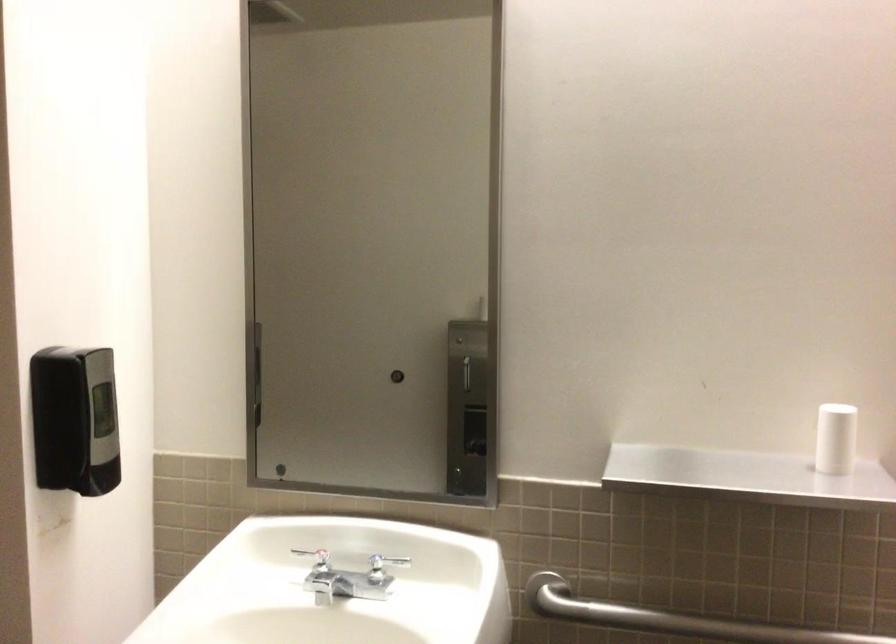
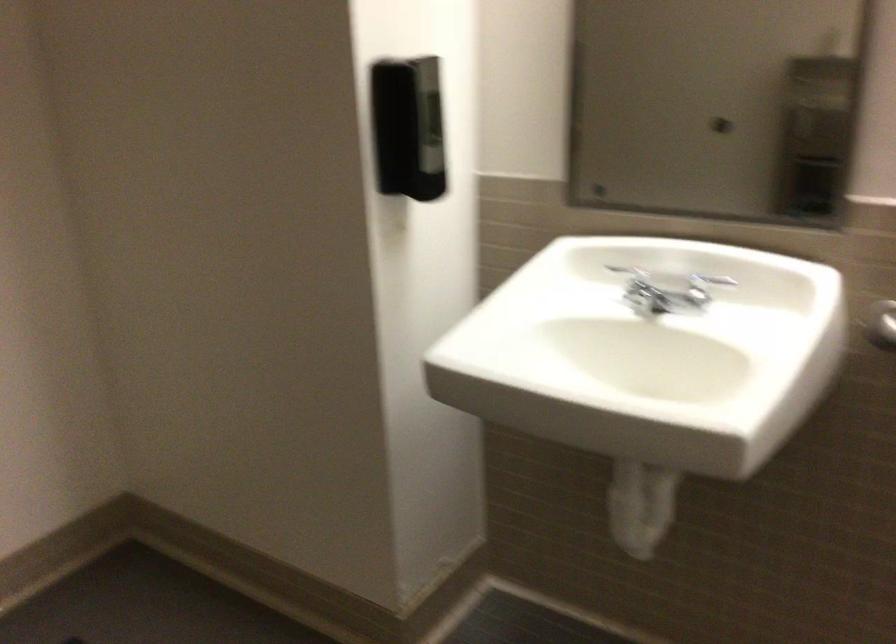
Locate, in the second image, the point that corresponds to point (385, 567) in the first image.

(704, 287)